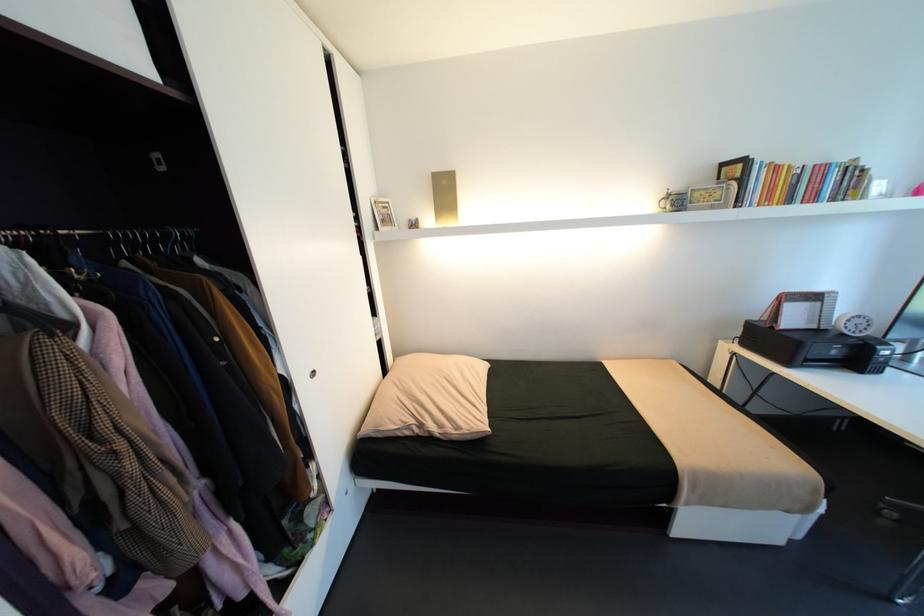
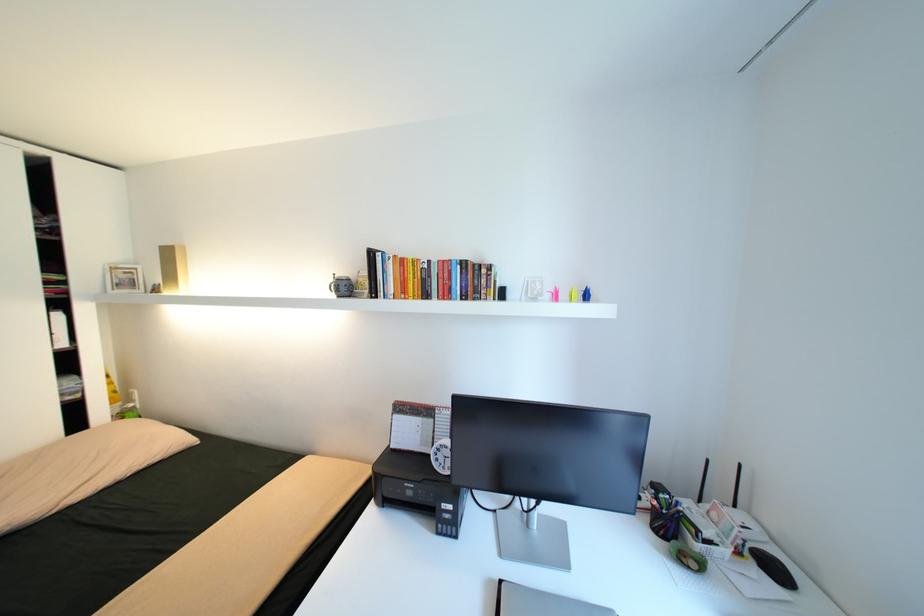
Find the pixel in the second image that matches (x=821, y=166) in the first image.

(445, 262)